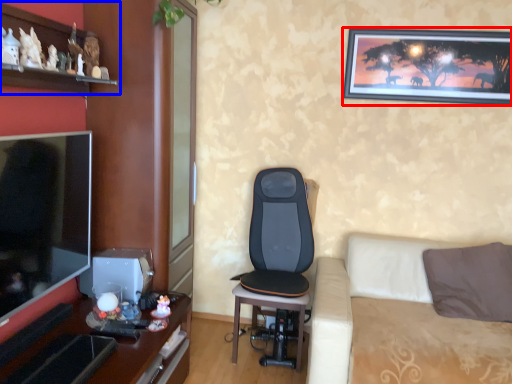
Question: Which object appears farthest to the camera in this image, picture frame (highlighted by a red box) or shelf (highlighted by a blue box)?

Choices:
 (A) picture frame
 (B) shelf

Answer: (A)